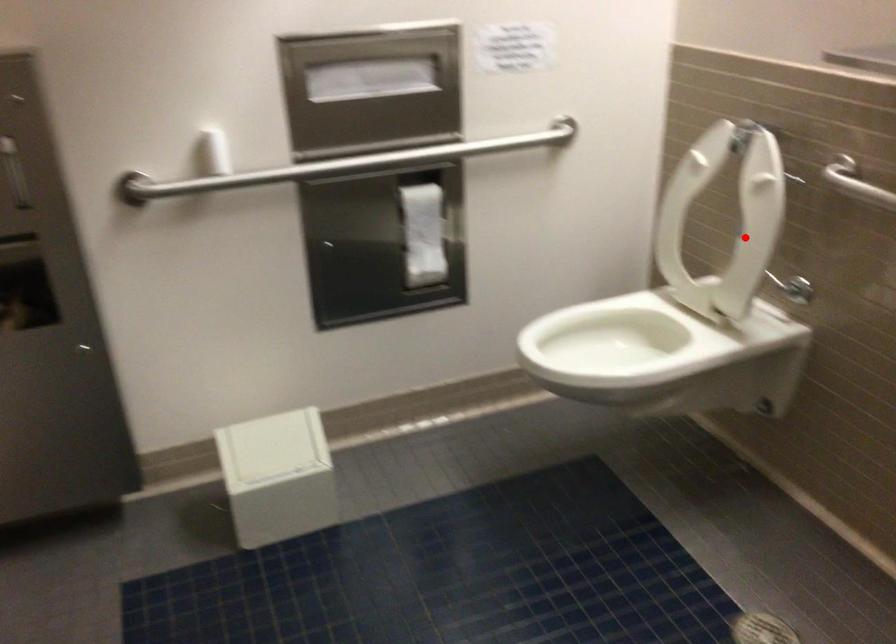
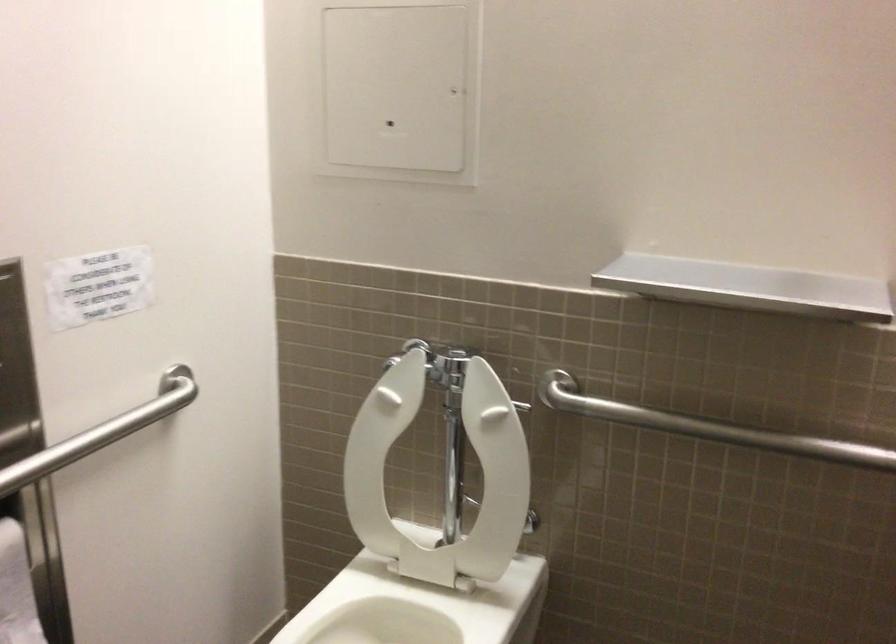
Locate, in the second image, the point that corresponds to the highlighted location in the first image.

(440, 474)